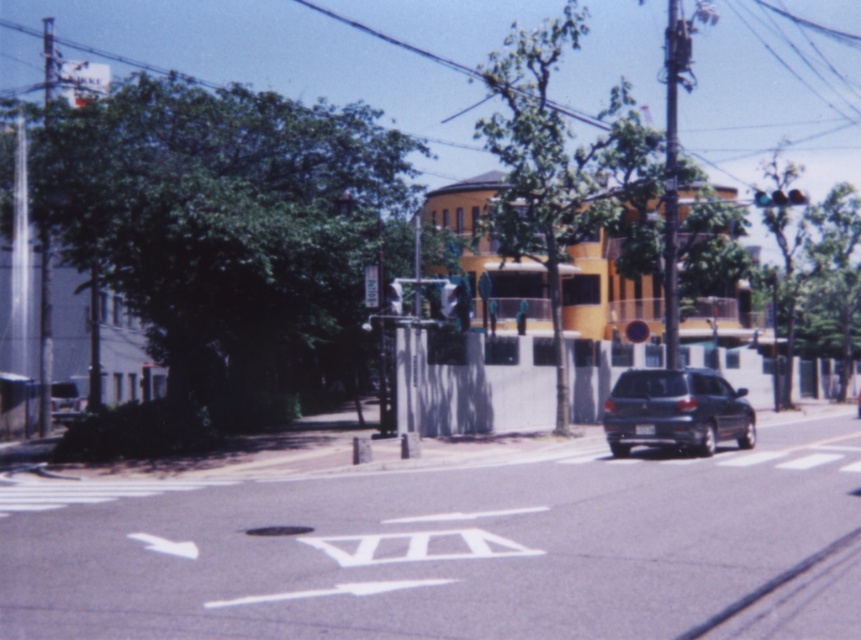
Is matte black suv at center above metallic reflective street sign at center?

Actually, matte black suv at center is below metallic reflective street sign at center.

Who is lower down, matte black suv at center or metallic reflective street sign at center?

matte black suv at center

Is point (671, 419) positioned behind point (367, 298)?

No, it is not.

You are a GUI agent. You are given a task and a screenshot of the screen. Output one action in this format:
    pyautogui.click(x=<x>, y=<y>)
    Task: Click on the matte black suv at center
    Image resolution: width=861 pixels, height=640 pixels.
    Given the screenshot: What is the action you would take?
    pyautogui.click(x=676, y=410)

Does point (453, 304) lie behind point (858, 397)?

No, (453, 304) is closer to viewer.

Is metallic silver traffic light at center taller than shiny silver sedan at center?

Indeed, metallic silver traffic light at center has a greater height compared to shiny silver sedan at center.

Describe the element at coordinates (447, 300) in the screenshot. I see `metallic silver traffic light at center` at that location.

The image size is (861, 640). What are the coordinates of `metallic silver traffic light at center` in the screenshot? It's located at (447, 300).

Consider the image. Is blue glass traffic light at upper right positioned in front of metallic silver traffic light at center?

No, it is behind metallic silver traffic light at center.

Is point (760, 195) positioned before point (444, 292)?

No, it is not.

Identify the location of blue glass traffic light at upper right. (779, 198).

At what (x,y) coordinates should I click in order to perform the action: click on blue glass traffic light at upper right. Please return your answer as a coordinate pair (x, y). Looking at the image, I should click on (779, 198).